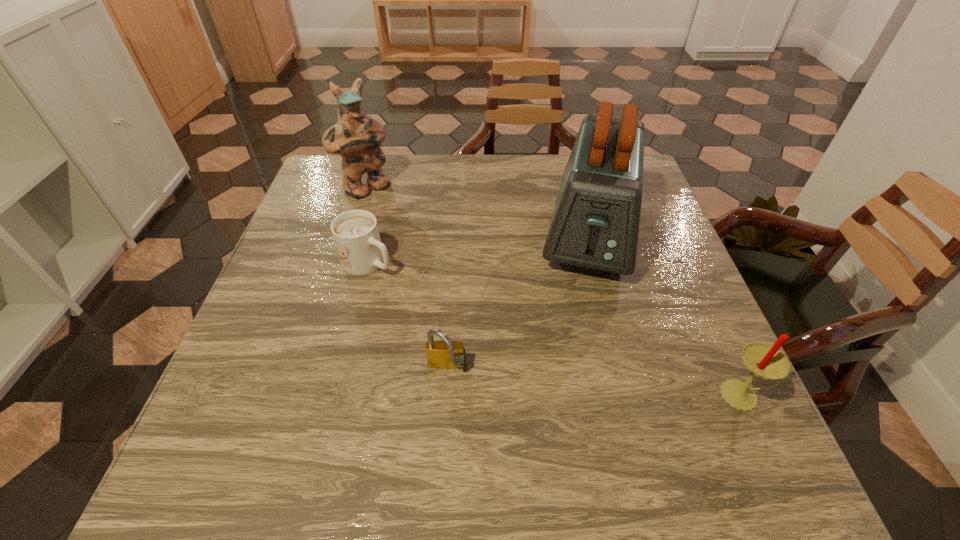
Find the location of a particular element. The image size is (960, 540). candle that is at the near edge is located at coordinates 763,360.

I want to click on figurine positioned at the left edge, so click(356, 137).

Where is `cappuccino present at the left edge`? The width and height of the screenshot is (960, 540). cappuccino present at the left edge is located at coordinates click(x=355, y=232).

Find the location of a particular element. The height and width of the screenshot is (540, 960). candle that is at the right edge is located at coordinates (763, 360).

The image size is (960, 540). What are the coordinates of `toaster that is at the right edge` in the screenshot? It's located at (595, 223).

The width and height of the screenshot is (960, 540). Find the location of `object that is positioned at the far left corner`. object that is positioned at the far left corner is located at coordinates (356, 137).

You are a GUI agent. You are given a task and a screenshot of the screen. Output one action in this format:
    pyautogui.click(x=<x>, y=<y>)
    Task: Click on the object located at the far right corner
    This screenshot has width=960, height=540.
    Given the screenshot: What is the action you would take?
    pyautogui.click(x=595, y=223)

You are a GUI agent. You are given a task and a screenshot of the screen. Output one action in this format:
    pyautogui.click(x=<x>, y=<y>)
    Task: Click on the object that is at the near right corner
    The image size is (960, 540).
    Given the screenshot: What is the action you would take?
    pyautogui.click(x=763, y=360)

The image size is (960, 540). Find the location of `free region at the far edge`. free region at the far edge is located at coordinates (424, 187).

Where is `vacant space at the near edge of the desktop`? This screenshot has width=960, height=540. vacant space at the near edge of the desktop is located at coordinates (530, 382).